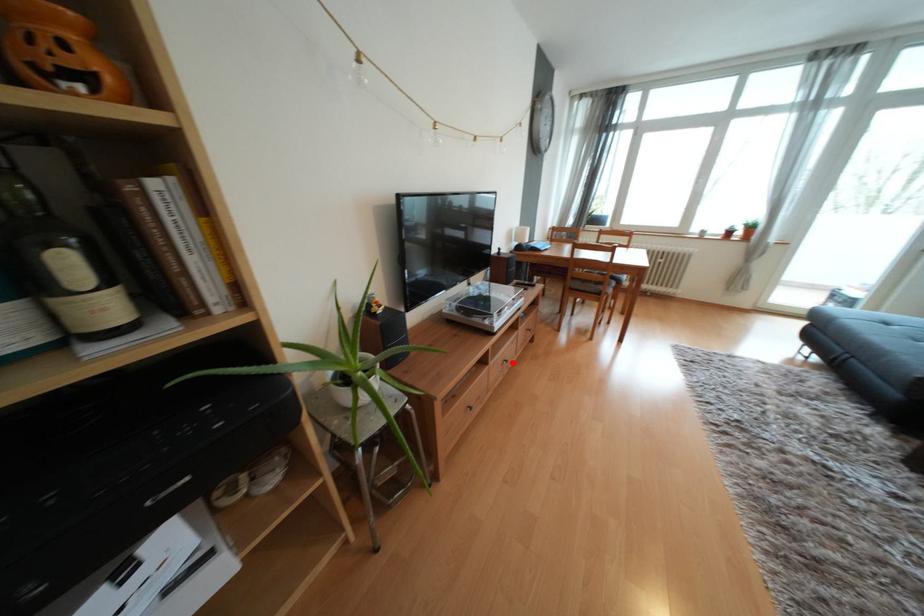
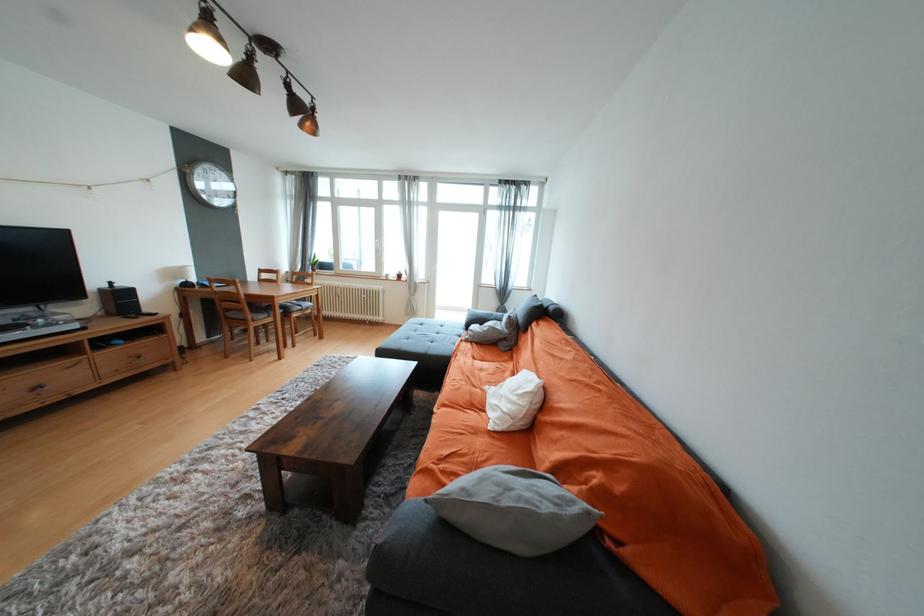
Question: I am providing you with two images of the same scene from different viewpoints. Given a red point in image1, look at the same physical point in image2. Is it:

Choices:
 (A) Closer to the viewpoint
 (B) Farther from the viewpoint

Answer: (B)